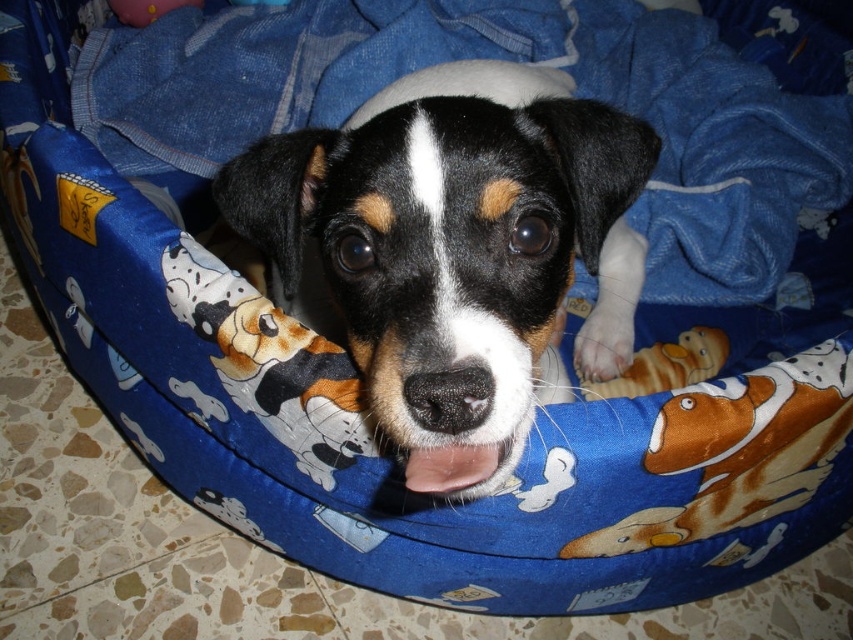
Does point (630, 246) come in front of point (602, 394)?

That is False.

Does black fur dog at center have a smaller size compared to brown plush dog at center?

Actually, black fur dog at center might be larger than brown plush dog at center.

Between point (550, 186) and point (708, 349), which one is positioned behind?

The point (708, 349) is more distant.

This screenshot has width=853, height=640. Identify the location of black fur dog at center. (454, 252).

Does blue fabric blanket at center have a greater height compared to brown plush dog at center?

Yes, blue fabric blanket at center is taller than brown plush dog at center.

Can you confirm if blue fabric blanket at center is shorter than brown plush dog at center?

Incorrect, blue fabric blanket at center's height does not fall short of brown plush dog at center's.

Which is in front, point (648, 52) or point (695, 364)?

Point (695, 364) is in front.

Where is `blue fabric blanket at center`? blue fabric blanket at center is located at coordinates (506, 60).

The width and height of the screenshot is (853, 640). What do you see at coordinates (454, 252) in the screenshot?
I see `black fur dog at center` at bounding box center [454, 252].

Is black fur dog at center smaller than blue fabric blanket at center?

Yes, black fur dog at center is smaller than blue fabric blanket at center.

Which is behind, point (563, 388) or point (650, 273)?

Positioned behind is point (650, 273).

At what (x,y) coordinates should I click in order to perform the action: click on black fur dog at center. Please return your answer as a coordinate pair (x, y). The width and height of the screenshot is (853, 640). Looking at the image, I should click on (454, 252).